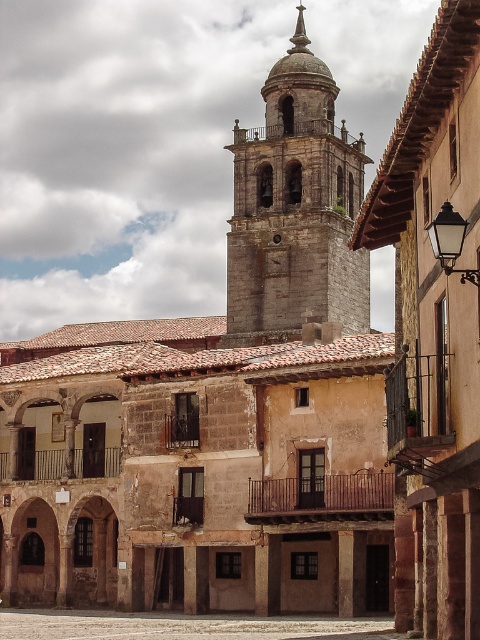
Does gray stone bell tower at upper center appear over smooth stone courtyard at center?

Correct, gray stone bell tower at upper center is located above smooth stone courtyard at center.

Is point (364, 298) farther from viewer compared to point (164, 636)?

Yes, point (364, 298) is farther from viewer.

Is point (302, 116) behind point (240, 618)?

Yes, it is.

Image resolution: width=480 pixels, height=640 pixels. What are the coordinates of `gray stone bell tower at upper center` in the screenshot? It's located at (295, 211).